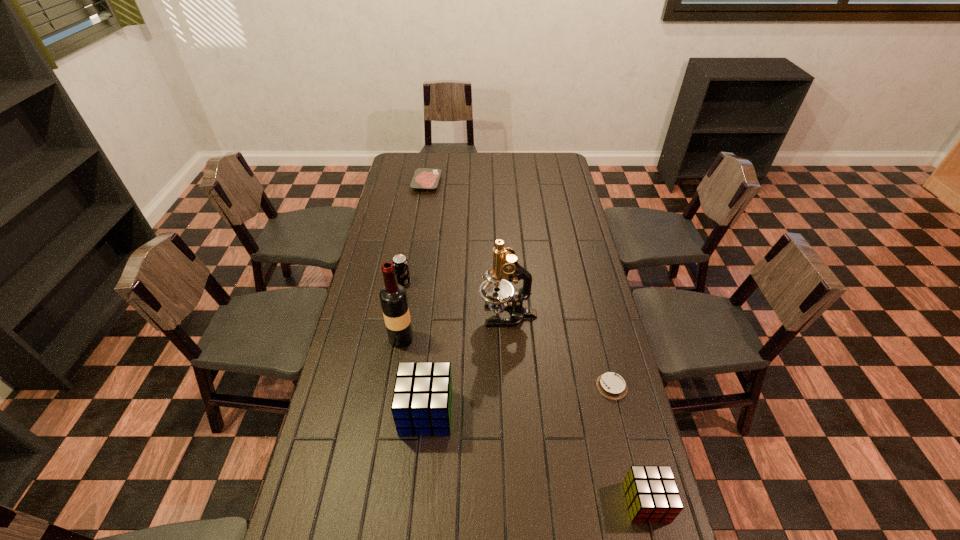
The image size is (960, 540). Find the location of `object that is positioned at the near edge`. object that is positioned at the near edge is located at coordinates (652, 495).

Locate an element on the screen. steak situated at the left edge is located at coordinates (423, 178).

I want to click on soda can that is at the left edge, so click(400, 262).

Image resolution: width=960 pixels, height=540 pixels. In order to click on wine bottle that is at the left edge in this screenshot , I will do `click(393, 297)`.

Identify the location of cube that is at the right edge. The height and width of the screenshot is (540, 960). (652, 495).

This screenshot has height=540, width=960. I want to click on chocolate cake that is at the right edge, so click(611, 385).

Identify the location of object situated at the far left corner. This screenshot has height=540, width=960. (423, 178).

The width and height of the screenshot is (960, 540). What are the coordinates of `object that is at the near right corner` in the screenshot? It's located at (652, 495).

In order to click on free region at the near edge in this screenshot , I will do `click(473, 512)`.

In the image, there is a desktop. Identify the location of free space at the right edge. The image size is (960, 540). (565, 211).